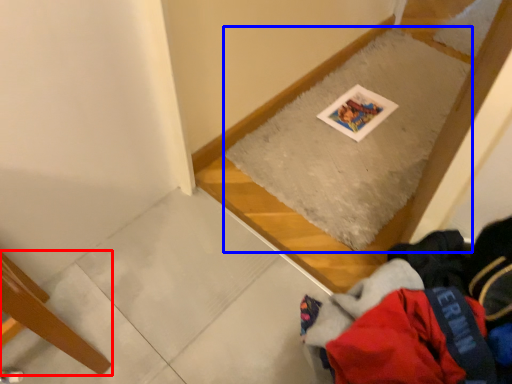
Question: Which point is further to the camera, furniture (highlighted by a red box) or mat (highlighted by a blue box)?

Choices:
 (A) furniture
 (B) mat

Answer: (B)